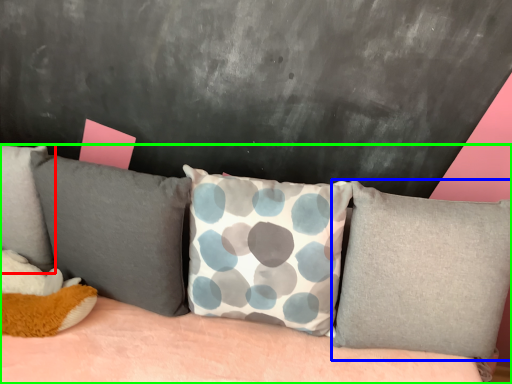
Question: Which object is positioned farthest from pillow (highlighted by a red box)? Select from pillow (highlighted by a blue box) and studio couch (highlighted by a green box).

Choices:
 (A) pillow
 (B) studio couch

Answer: (A)